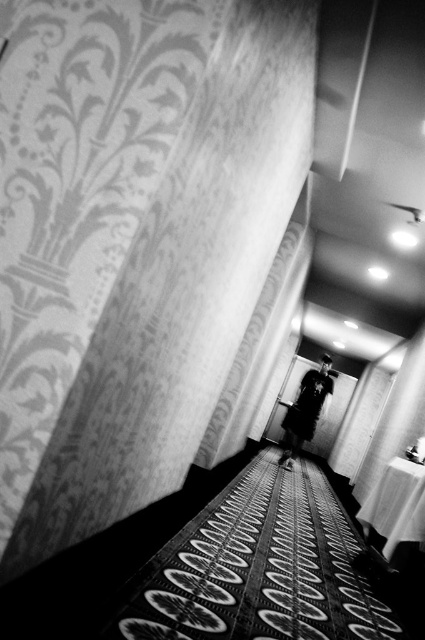
Question: Can you confirm if silky white curtain at center is thinner than silky white curtain at right?

Choices:
 (A) no
 (B) yes

Answer: (A)

Question: Can you confirm if silky white curtain at center is bigger than dark fabric coat at center?

Choices:
 (A) no
 (B) yes

Answer: (B)

Question: Which point appears farthest from the camera in this image?

Choices:
 (A) pos(309,428)
 (B) pos(408,349)

Answer: (B)

Question: Is silky white curtain at center smaller than silky white curtain at right?

Choices:
 (A) yes
 (B) no

Answer: (B)

Question: Which object is positioned closest to the silky white curtain at center?

Choices:
 (A) silky white curtain at right
 (B) dark fabric coat at center

Answer: (B)

Question: Which of these objects is positioned farthest from the silky white curtain at right?

Choices:
 (A) silky white curtain at center
 (B) dark fabric coat at center

Answer: (A)